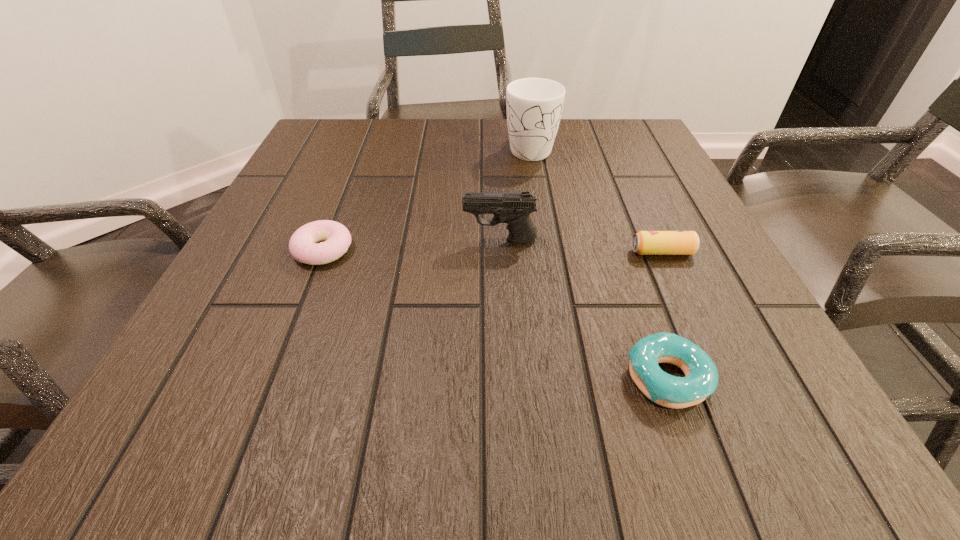
The image size is (960, 540). I want to click on vacant space that satisfies the following two spatial constraints: 1. at the barrel of the pistol; 2. on the left side of the nearest object, so click(x=507, y=378).

The height and width of the screenshot is (540, 960). Find the location of `free space that satisfies the following two spatial constraints: 1. on the side of the beer can with the handle; 2. on the left side of the mug`. free space that satisfies the following two spatial constraints: 1. on the side of the beer can with the handle; 2. on the left side of the mug is located at coordinates (547, 252).

Find the location of a particular element. vacant area that satisfies the following two spatial constraints: 1. on the side of the beer can with the handle; 2. on the left side of the tallest object is located at coordinates (547, 252).

At what (x,y) coordinates should I click in order to perform the action: click on free space that satisfies the following two spatial constraints: 1. on the side of the mug with the handle; 2. at the barrel of the pistol. Please return your answer as a coordinate pair (x, y). The width and height of the screenshot is (960, 540). Looking at the image, I should click on (545, 240).

This screenshot has height=540, width=960. What are the coordinates of `vacant space that satisfies the following two spatial constraints: 1. at the barrel of the fourth shortest object; 2. on the front side of the farther doughnut` in the screenshot? It's located at (500, 250).

You are a GUI agent. You are given a task and a screenshot of the screen. Output one action in this format:
    pyautogui.click(x=<x>, y=<y>)
    Task: Click on the free space that satisfies the following two spatial constraints: 1. at the barrel of the fourth shortest object; 2. on the front side of the left doughnut
    Image resolution: width=960 pixels, height=540 pixels.
    Given the screenshot: What is the action you would take?
    pyautogui.click(x=500, y=250)

Identify the location of vacant space that satisfies the following two spatial constraints: 1. on the side of the beer can with the handle; 2. on the left side of the farthest object. This screenshot has width=960, height=540. (547, 252).